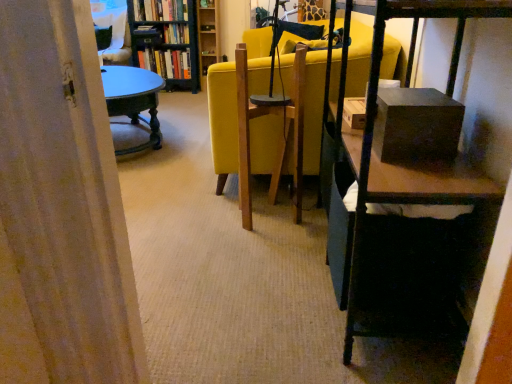
Question: Based on their positions, is hardcover book at center, placed as the 2th book when sorted from bottom to top, located to the left or right of hardcover book at upper left, positioned as the 3th book in top-to-bottom order?

Choices:
 (A) left
 (B) right

Answer: (B)

Question: Considering the positions of hardcover book at center, placed as the 2th book when sorted from bottom to top, and hardcover book at upper left, the first book ordered from the bottom, in the image, is hardcover book at center, placed as the 2th book when sorted from bottom to top, taller or shorter than hardcover book at upper left, the first book ordered from the bottom,?

Choices:
 (A) short
 (B) tall

Answer: (A)

Question: Estimate the real-world distances between objects in this image. Which object is farther from the hardcover book at center, the 2th book in the top-to-bottom sequence?

Choices:
 (A) wooden bookshelf at upper center
 (B) hardcover book at upper left, the first book ordered from the bottom
 (C) green painted wood table at center left
 (D) hardcover books at upper left, which is the 3th book from bottom to top
 (E) wooden bookshelf at upper left

Answer: (C)

Question: Which is nearer to the green painted wood table at center left?

Choices:
 (A) hardcover book at center, placed as the 2th book when sorted from bottom to top
 (B) wooden bookshelf at upper left
 (C) hardcover books at upper left, placed as the 1th book when sorted from top to bottom
 (D) wooden bookshelf at upper center
 (E) hardcover book at upper left, the first book ordered from the bottom

Answer: (B)